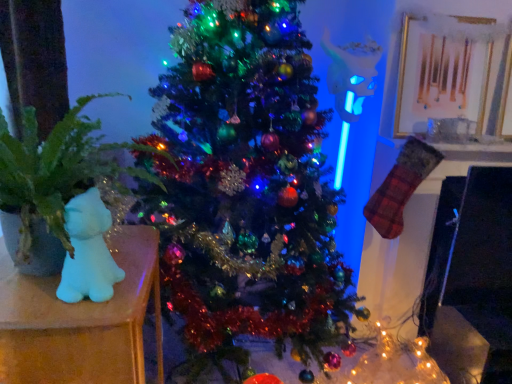
Question: Is white matte plush cat at left further to camera compared to shiny green christmas tree at center?

Choices:
 (A) yes
 (B) no

Answer: (B)

Question: Is white matte plush cat at left looking in the opposite direction of shiny green christmas tree at center?

Choices:
 (A) yes
 (B) no

Answer: (B)

Question: Is white matte plush cat at left in front of shiny green christmas tree at center?

Choices:
 (A) yes
 (B) no

Answer: (A)

Question: Is white matte plush cat at left wider than shiny green christmas tree at center?

Choices:
 (A) no
 (B) yes

Answer: (A)

Question: From the image's perspective, is white matte plush cat at left on shiny green christmas tree at center?

Choices:
 (A) yes
 (B) no

Answer: (B)

Question: Is white matte plush cat at left smaller than shiny green christmas tree at center?

Choices:
 (A) yes
 (B) no

Answer: (A)

Question: Is white matte bear at left smaller than shiny green christmas tree at center?

Choices:
 (A) no
 (B) yes

Answer: (B)

Question: From the image's perspective, is white matte bear at left under shiny green christmas tree at center?

Choices:
 (A) yes
 (B) no

Answer: (A)

Question: Can you confirm if white matte bear at left is bigger than shiny green christmas tree at center?

Choices:
 (A) yes
 (B) no

Answer: (B)

Question: Considering the relative positions of white matte bear at left and shiny green christmas tree at center in the image provided, is white matte bear at left to the right of shiny green christmas tree at center from the viewer's perspective?

Choices:
 (A) yes
 (B) no

Answer: (B)

Question: Considering the relative sizes of white matte bear at left and shiny green christmas tree at center in the image provided, is white matte bear at left thinner than shiny green christmas tree at center?

Choices:
 (A) no
 (B) yes

Answer: (B)

Question: Can shiny green christmas tree at center be found inside white matte bear at left?

Choices:
 (A) no
 (B) yes

Answer: (A)

Question: From the image's perspective, is white matte bear at left located above green matte plant at left?

Choices:
 (A) yes
 (B) no

Answer: (B)